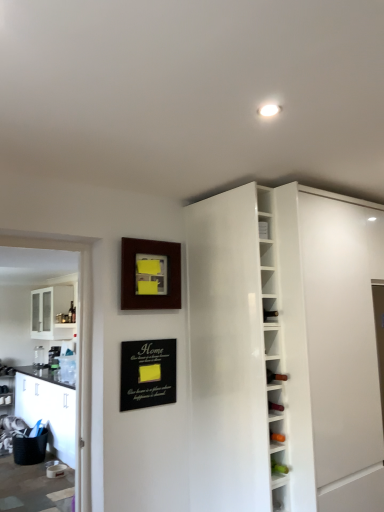
Question: From a real-world perspective, relative to black matte bulletin board at lower center, is wooden picture frame at upper center vertically above or below?

Choices:
 (A) above
 (B) below

Answer: (A)

Question: In the image, is wooden picture frame at upper center positioned in front of or behind black matte bulletin board at lower center?

Choices:
 (A) behind
 (B) front

Answer: (A)

Question: Estimate the real-world distances between objects in this image. Which object is closer to the white glossy cabinet at upper right?

Choices:
 (A) black matte bulletin board at lower center
 (B) wooden picture frame at upper center
 (C) green matte bottle at lower right

Answer: (A)

Question: Estimate the real-world distances between objects in this image. Which object is closer to the white glossy cabinet at upper right?

Choices:
 (A) wooden picture frame at upper center
 (B) black matte bulletin board at lower center
 (C) green matte bottle at lower right

Answer: (B)